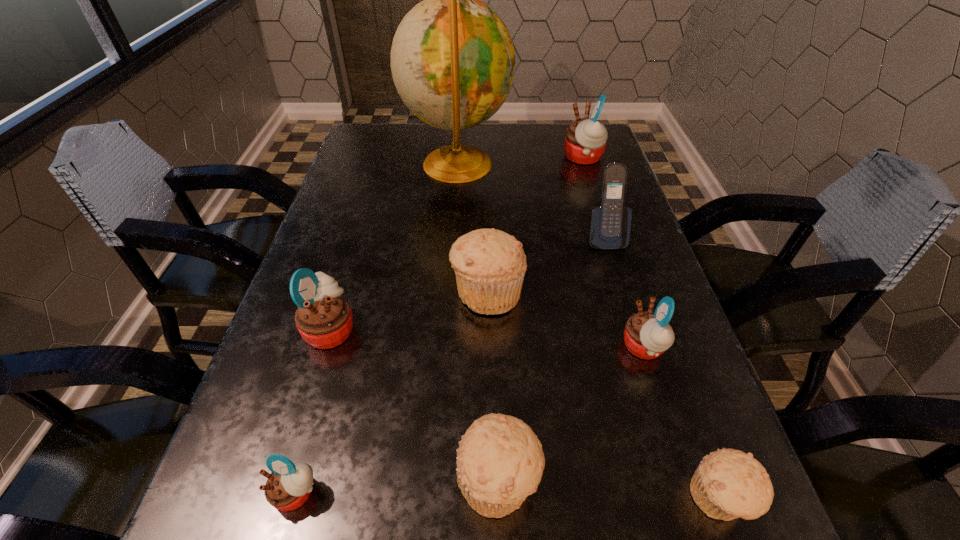
This screenshot has height=540, width=960. I want to click on free spot located on the front of the tallest object, so click(x=449, y=274).

The image size is (960, 540). Find the location of `free space located 0.150m on the front-facing side of the tallest muffin`. free space located 0.150m on the front-facing side of the tallest muffin is located at coordinates (511, 158).

Identify the location of vacant space situated on the front-facing side of the tallest muffin. The image size is (960, 540). (521, 158).

The height and width of the screenshot is (540, 960). I want to click on vacant space located 0.280m on the front-facing side of the tallest muffin, so click(466, 158).

The width and height of the screenshot is (960, 540). Find the location of `vacant space located on the front-facing side of the third farthest object`. vacant space located on the front-facing side of the third farthest object is located at coordinates (651, 388).

Locate an element on the screen. free space located 0.080m on the front-facing side of the third smallest pink muffin is located at coordinates (399, 329).

In order to click on free space located 0.100m on the left of the farthest beige muffin in this screenshot , I will do `click(402, 292)`.

Where is `vacant space located on the front-facing side of the second smallest pink muffin`? The image size is (960, 540). vacant space located on the front-facing side of the second smallest pink muffin is located at coordinates pyautogui.click(x=441, y=348).

Image resolution: width=960 pixels, height=540 pixels. In order to click on vacant point located 0.150m on the front-facing side of the second smallest pink muffin in this screenshot , I will do `click(540, 348)`.

Identify the location of vacant space located 0.370m on the front-facing side of the second smallest pink muffin. (419, 348).